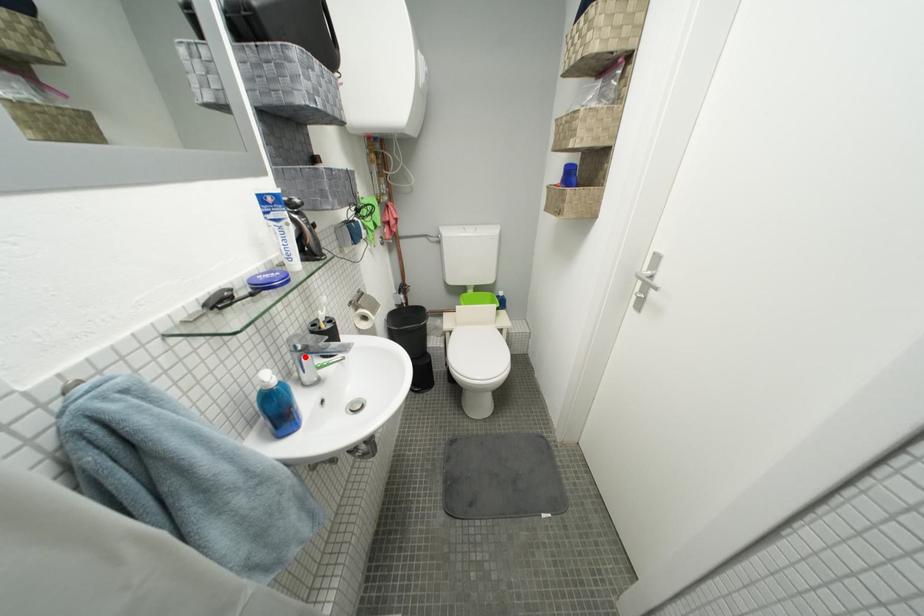
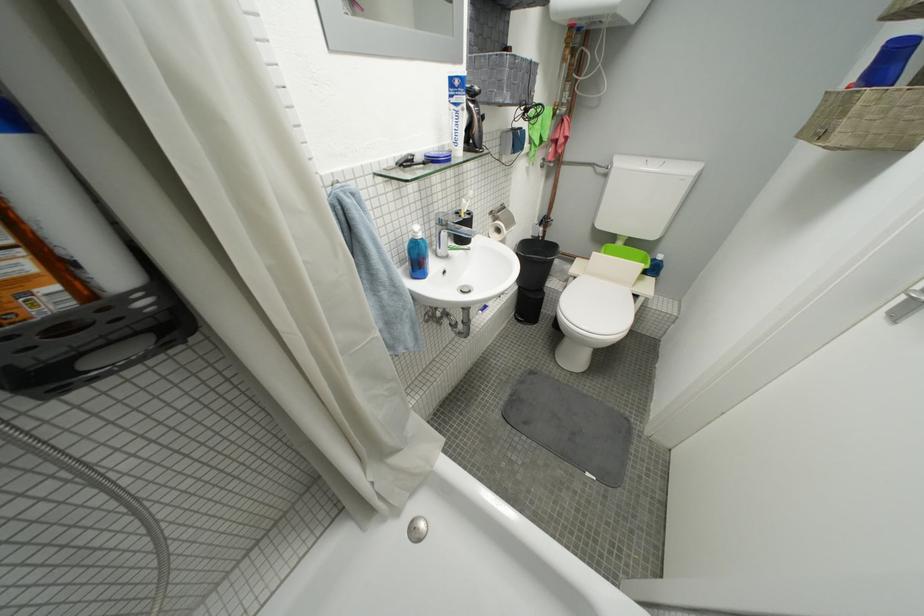
In the second image, find the point that corresponds to the highlighted location in the first image.

(447, 230)